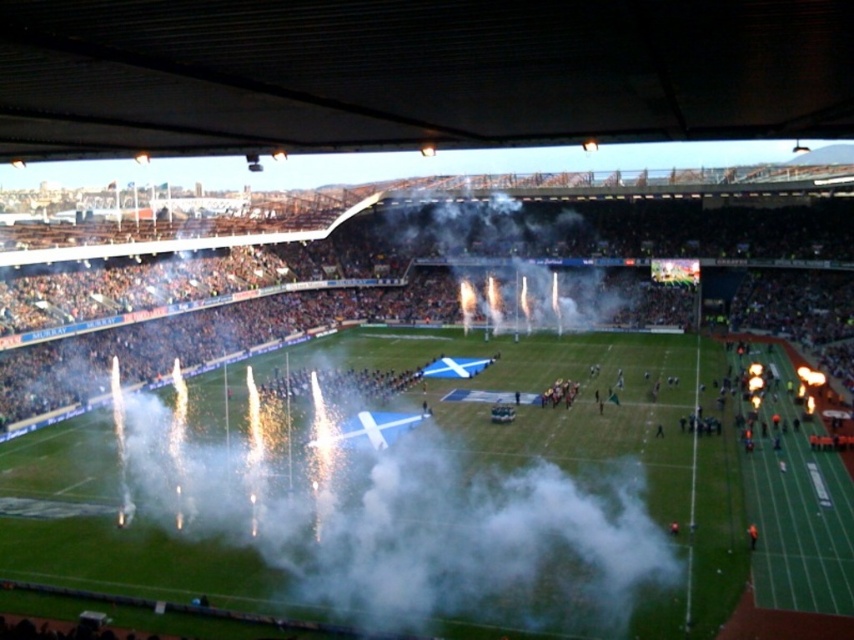
Question: Among these points, which one is nearest to the camera?

Choices:
 (A) (604, 497)
 (B) (551, 232)

Answer: (A)

Question: Is white fog at center to the right of white smoke at center from the viewer's perspective?

Choices:
 (A) yes
 (B) no

Answer: (B)

Question: Can you confirm if white fog at center is positioned to the left of white smoke at center?

Choices:
 (A) yes
 (B) no

Answer: (A)

Question: Which of the following is the farthest from the observer?

Choices:
 (A) (513, 502)
 (B) (480, 289)

Answer: (B)

Question: Which point is closer to the camera?

Choices:
 (A) white fog at center
 (B) white smoke at center

Answer: (A)

Question: Is white fog at center thinner than white smoke at center?

Choices:
 (A) yes
 (B) no

Answer: (B)